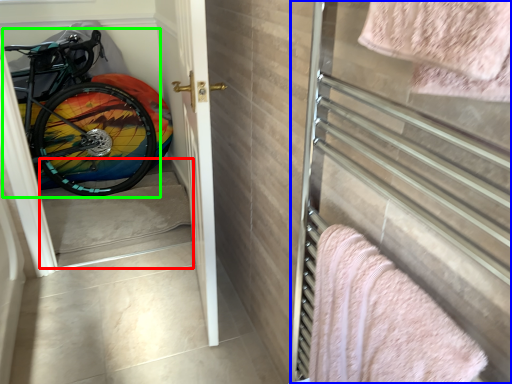
Question: Considering the real-world distances, which object is farthest from stairwell (highlighted by a red box)? screen door (highlighted by a blue box) or bicycle (highlighted by a green box)?

Choices:
 (A) screen door
 (B) bicycle

Answer: (A)